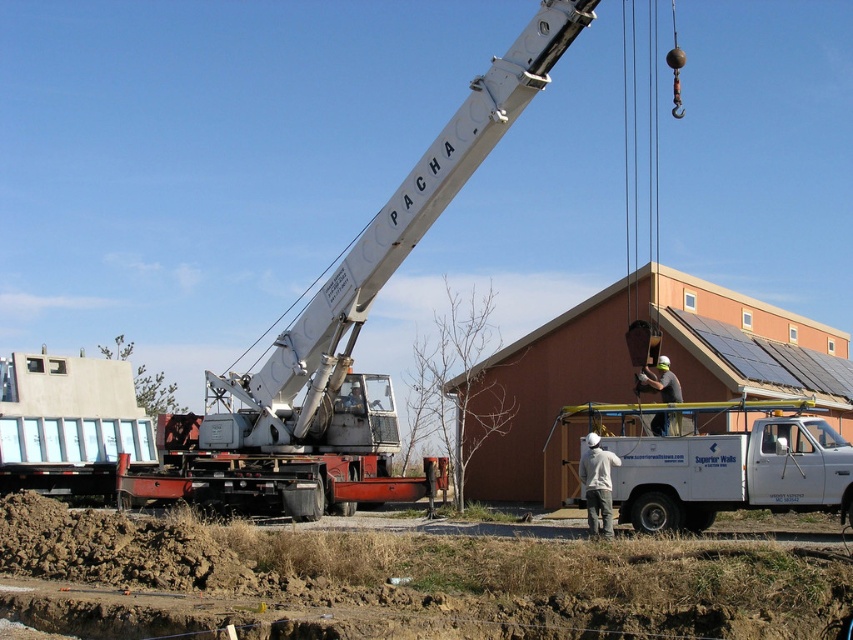
Between white matte truck at center and white matte helmet at center, which one appears on the right side from the viewer's perspective?

From the viewer's perspective, white matte truck at center appears more on the right side.

What are the coordinates of `white matte truck at center` in the screenshot? It's located at (706, 461).

Which is behind, point (706, 401) or point (601, 481)?

The point (706, 401) is more distant.

What are the coordinates of `white matte truck at center` in the screenshot? It's located at (706, 461).

Is white matte helmet at center wider than gray fabric construction worker at center?

No.

Between white matte helmet at center and gray fabric construction worker at center, which one has less height?

Standing shorter between the two is gray fabric construction worker at center.

Find the location of a particular element. white matte helmet at center is located at coordinates (596, 483).

Who is positioned more to the left, white matte truck at center or gray fabric construction worker at center?

gray fabric construction worker at center

Does white matte truck at center have a smaller size compared to gray fabric construction worker at center?

Yes, white matte truck at center is smaller than gray fabric construction worker at center.

Is point (723, 486) less distant than point (675, 388)?

Yes, it is in front of point (675, 388).

You are a GUI agent. You are given a task and a screenshot of the screen. Output one action in this format:
    pyautogui.click(x=<x>, y=<y>)
    Task: Click on the white matte truck at center
    This screenshot has width=853, height=640.
    Given the screenshot: What is the action you would take?
    pyautogui.click(x=706, y=461)